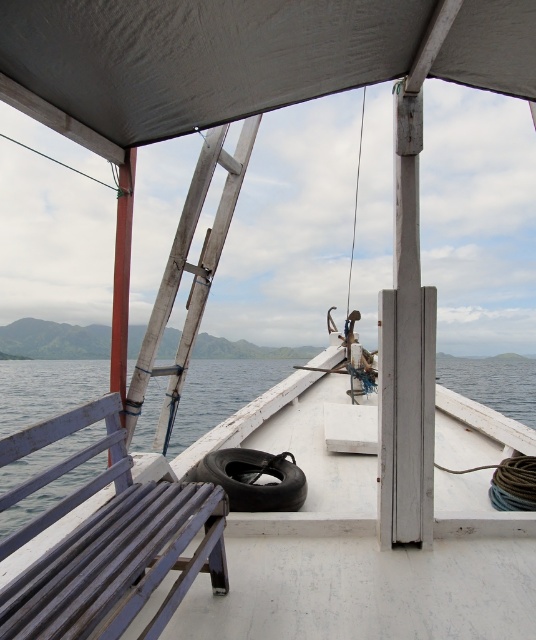
Question: Which point appears closest to the camera in this image?

Choices:
 (A) (85, 365)
 (B) (58, 122)
 (C) (196, 472)

Answer: (B)

Question: Which point appears farthest from the camera in this image?

Choices:
 (A) (189, 122)
 (B) (153, 426)

Answer: (B)

Question: Is wooden textured ladder at center positioned at the back of black rubber tire at center?

Choices:
 (A) no
 (B) yes

Answer: (B)

Question: Is blue water at lower left to the right of black rubber tire at center from the viewer's perspective?

Choices:
 (A) no
 (B) yes

Answer: (A)

Question: Does white matte canopy at upper center appear on the right side of blue water at lower left?

Choices:
 (A) no
 (B) yes

Answer: (B)

Question: Which object appears farthest from the camera in this image?

Choices:
 (A) white matte canopy at upper center
 (B) black rubber tire at center

Answer: (B)